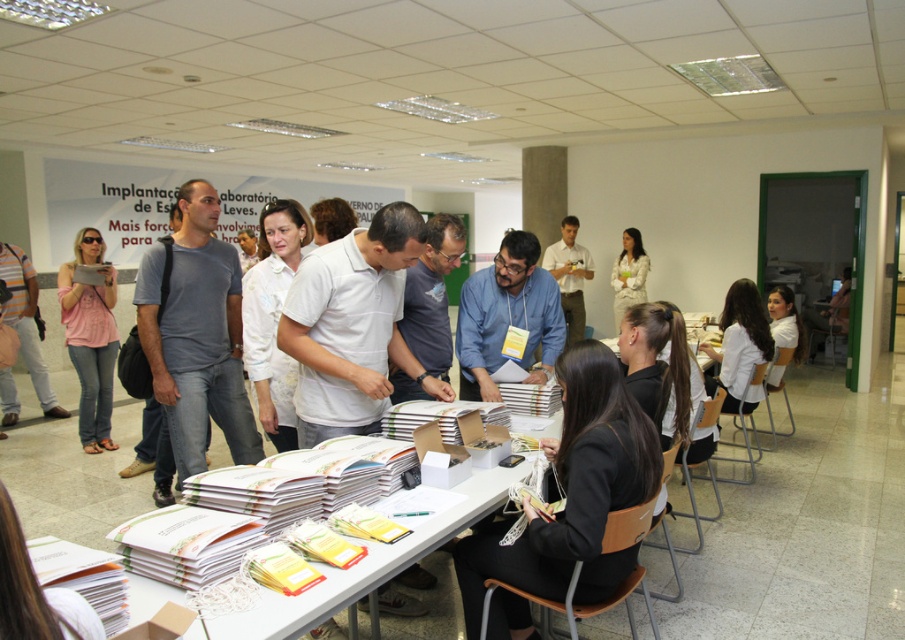
Question: Is blue shirt at center positioned at the back of white matte shirt at upper right?

Choices:
 (A) no
 (B) yes

Answer: (A)

Question: Does white paper at center appear under pink cotton shirt at center?

Choices:
 (A) no
 (B) yes

Answer: (B)

Question: Which point is farther to the camera?

Choices:
 (A) (582, 333)
 (B) (215, 444)
 (C) (484, 289)
 (D) (618, 324)

Answer: (A)

Question: From the image, what is the correct spatial relationship of matte white shirt at center in relation to white matte shirt at upper right?

Choices:
 (A) left
 (B) right

Answer: (A)

Question: Which object is the closest to the matte white shirt at center?

Choices:
 (A) white paper at center
 (B) white matte shirt at upper right

Answer: (B)

Question: Which object appears closest to the camera in this image?

Choices:
 (A) matte white shirt at center
 (B) white matte shirt at upper right
 (C) black fabric jacket at lower right
 (D) pink cotton shirt at center

Answer: (C)